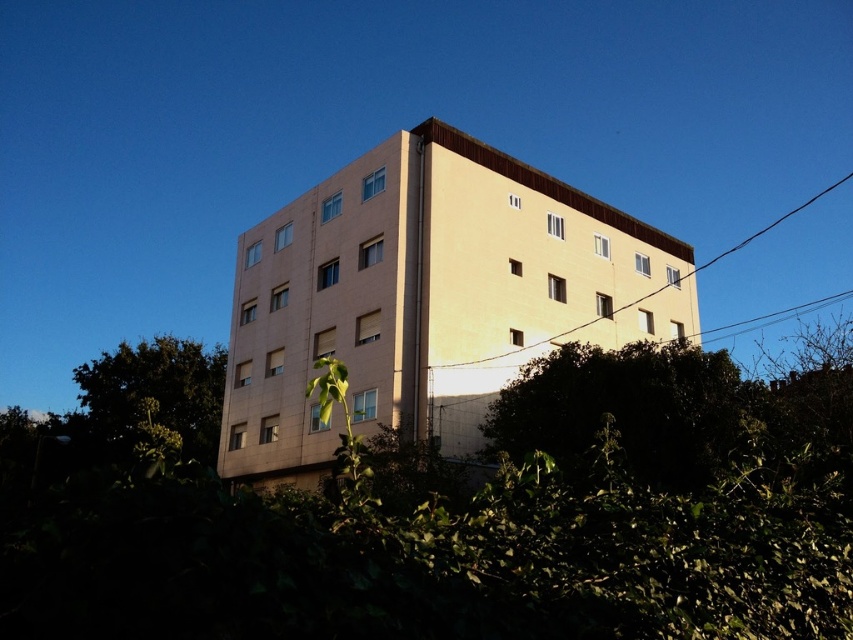
Does green leafy hedge at lower center have a lesser height compared to tan smooth building at center?

Correct, green leafy hedge at lower center is not as tall as tan smooth building at center.

Who is more distant from viewer, (213, 609) or (480, 362)?

Point (480, 362)

Identify the location of green leafy hedge at lower center. The width and height of the screenshot is (853, 640). (456, 518).